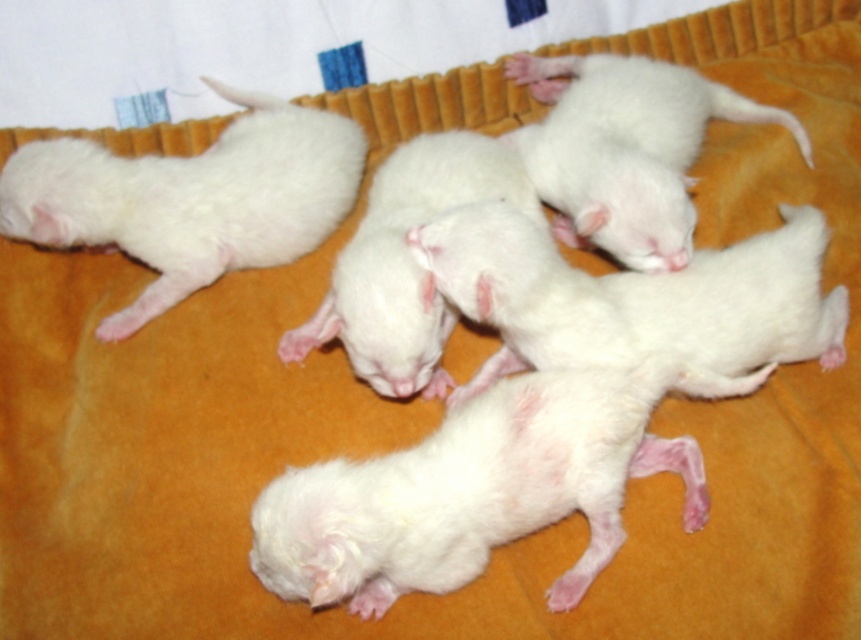
You are a photographer trying to capture a closeup of the white fluffy puppies at center and the white soft fur kitten at center. Which one is located to the right of the other?

The white fluffy puppies at center is positioned on the right side of white soft fur kitten at center.

You are taking a photo of the puppies and want to focus on the point at position (503, 420) and the point at position (302, 160). Which point is closer to your camera lens?

Point (503, 420) is closer to the camera lens than point (302, 160).

In the scene shown: You are a photographer trying to position a toy mouse between the white fluffy puppy at center and the white fluffy kitten at upper left. Since the toy mouse is 10 cm tall, will it fit comfortably between them without touching either animal?

The white fluffy puppy at center is not as tall as the white fluffy kitten at upper left, so the toy mouse might not fit comfortably between them since the height difference could cause it to touch one of them.